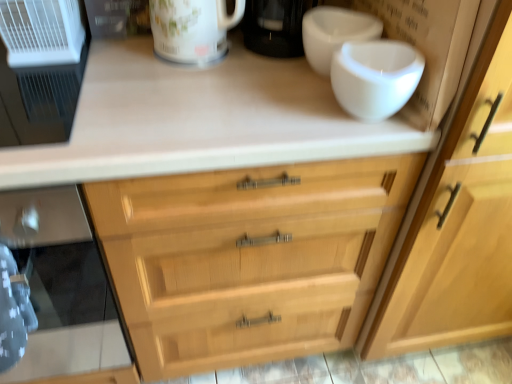
You are a GUI agent. You are given a task and a screenshot of the screen. Output one action in this format:
    pyautogui.click(x=<x>, y=<y>)
    Task: Click on the vacant area that is in front of glossy ceramic mug at upper center
    
    Given the screenshot: What is the action you would take?
    pyautogui.click(x=188, y=92)